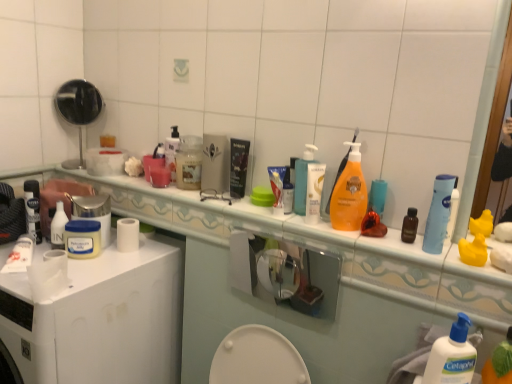
Locate an element on the screen. The image size is (512, 384). vacant area that is situated to the right of white plastic jar at upper left, acting as the third mouthwash starting from the right is located at coordinates (129, 257).